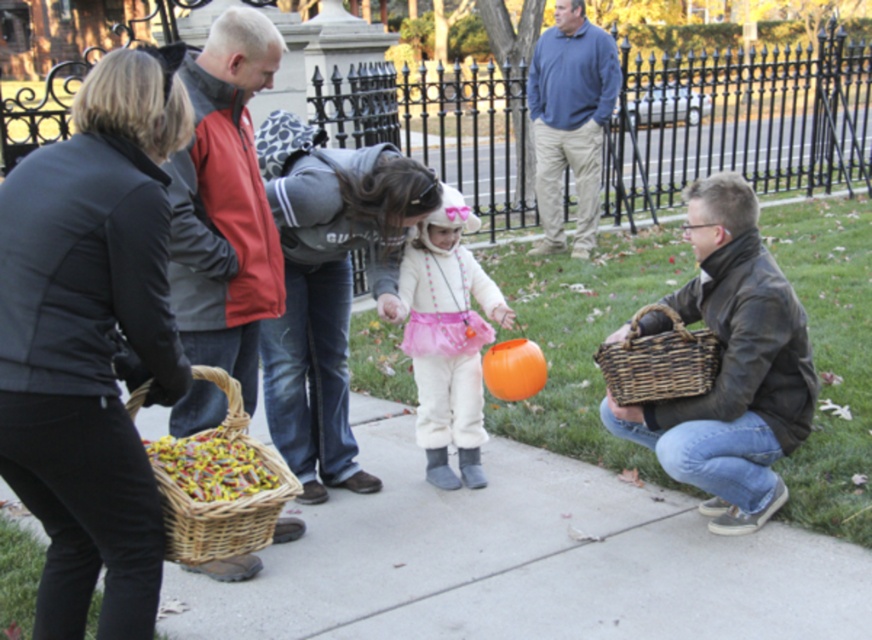
You are standing on the sidewalk in the Halloween scene. There is a red jacket at center. Where is the red jacket located relative to the child in the bunny costume?

The red jacket at center is located at point (225,204). However, without additional spatial references, it is impossible to determine its exact position relative to the child in the bunny costume. Please provide more information about the child or other landmarks.

You are a parent watching your child trick or treating. You see the red jacket at center and the woven brown basket at lower right. Which object is closer to you?

The red jacket at center is closer to you since it is in front of the woven brown basket at lower right.